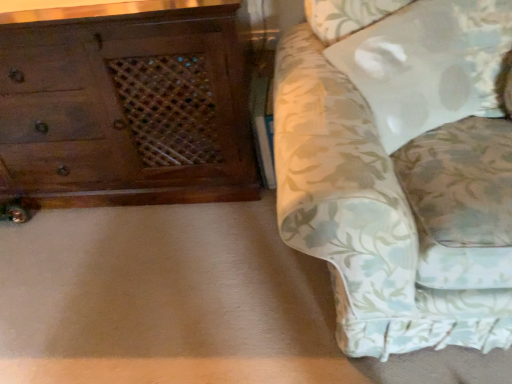
Question: Is white fabric pillow at upper right outside wooden chest of drawers at left?

Choices:
 (A) no
 (B) yes

Answer: (B)

Question: Is white fabric pillow at upper right in front of wooden chest of drawers at left?

Choices:
 (A) yes
 (B) no

Answer: (A)

Question: Could you tell me if white fabric pillow at upper right is turned towards wooden chest of drawers at left?

Choices:
 (A) no
 (B) yes

Answer: (A)

Question: From the image's perspective, does white fabric pillow at upper right appear higher than wooden chest of drawers at left?

Choices:
 (A) yes
 (B) no

Answer: (B)

Question: Is wooden chest of drawers at left inside white fabric pillow at upper right?

Choices:
 (A) yes
 (B) no

Answer: (B)

Question: Is white fabric pillow at upper right shorter than wooden chest of drawers at left?

Choices:
 (A) yes
 (B) no

Answer: (A)

Question: Considering the relative sizes of floral fabric couch at right and wooden chest of drawers at left in the image provided, is floral fabric couch at right shorter than wooden chest of drawers at left?

Choices:
 (A) no
 (B) yes

Answer: (A)

Question: Is floral fabric couch at right positioned far away from wooden chest of drawers at left?

Choices:
 (A) no
 (B) yes

Answer: (A)

Question: Is floral fabric couch at right behind wooden chest of drawers at left?

Choices:
 (A) yes
 (B) no

Answer: (B)

Question: From the image's perspective, is floral fabric couch at right on wooden chest of drawers at left?

Choices:
 (A) no
 (B) yes

Answer: (A)

Question: Is floral fabric couch at right turned away from wooden chest of drawers at left?

Choices:
 (A) yes
 (B) no

Answer: (B)

Question: Does floral fabric couch at right have a lesser width compared to wooden chest of drawers at left?

Choices:
 (A) yes
 (B) no

Answer: (B)

Question: Is wooden chest of drawers at left at the right side of floral fabric couch at right?

Choices:
 (A) yes
 (B) no

Answer: (B)